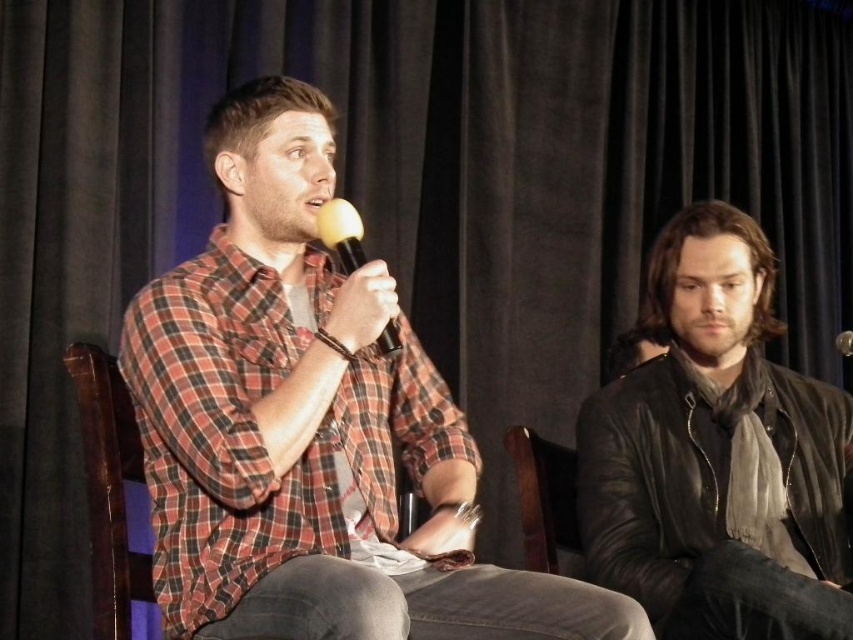
You are an event organizer setting up a stage for a panel discussion. You have the brown leather chair at center and the yellow matte microphone at center. To ensure the speaker can comfortably reach the microphone, which object should be placed closer to the front of the stage?

The brown leather chair at center should be positioned closer to the front of the stage so that the speaker can comfortably reach the yellow matte microphone at center placed above it.